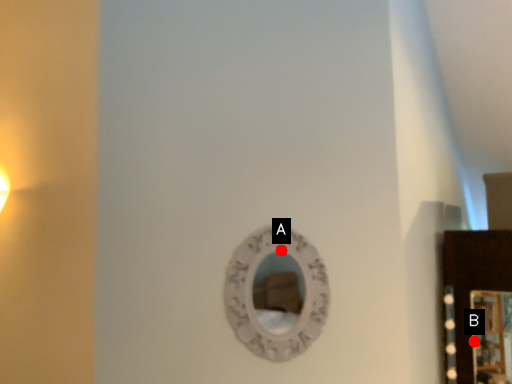
Question: Two points are circled on the image, labeled by A and B beside each circle. Which point is closer to the camera taking this photo?

Choices:
 (A) A is closer
 (B) B is closer

Answer: (A)